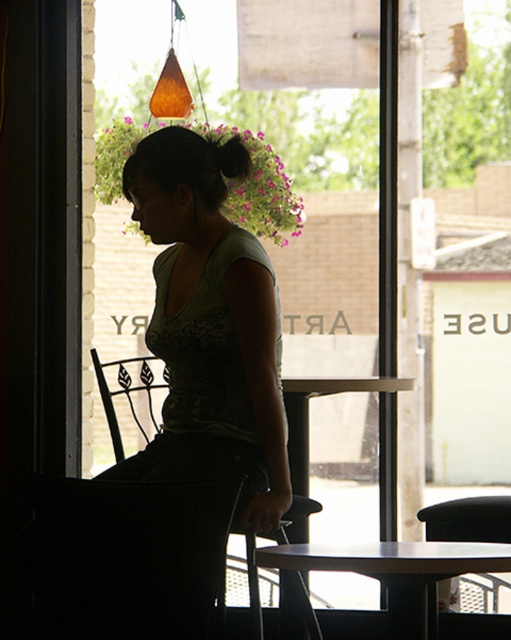
You are standing in the cafe and want to sit down. There is a metallic black chair at left. Can you estimate its position relative to the center of the room?

The metallic black chair at left is located at coordinates 0.617 on the x axis and 0.249 on the y axis, so it is positioned to the left and slightly below the center of the room.